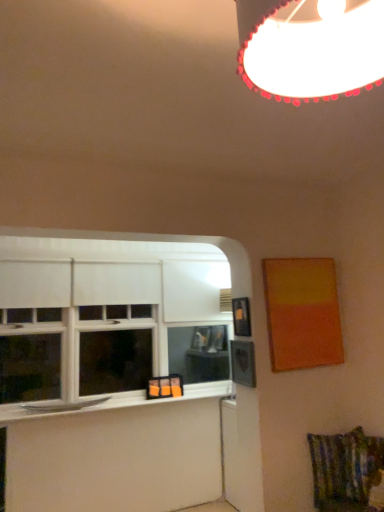
Question: Is white glossy window sill at lower left taller or shorter than white glossy lampshade at upper center?

Choices:
 (A) tall
 (B) short

Answer: (B)

Question: Considering the positions of point (117, 395) and point (312, 7), is point (117, 395) closer or farther from the camera than point (312, 7)?

Choices:
 (A) farther
 (B) closer

Answer: (A)

Question: Which is nearer to the matte orange painting at right, which is the 2th picture frame in left-to-right order?

Choices:
 (A) white matte window at lower left
 (B) white glossy window sill at lower left
 (C) textured multicolored fabric swivel chair at lower right
 (D) white glossy lampshade at upper center
 (E) black plastic picture frame at upper right, the second picture frame viewed from the right

Answer: (E)

Question: Which object is positioned closest to the black plastic picture frame at upper right, placed as the first picture frame when sorted from left to right?

Choices:
 (A) textured multicolored fabric swivel chair at lower right
 (B) matte orange painting at right, which is the 2th picture frame in left-to-right order
 (C) white glossy lampshade at upper center
 (D) white matte window at lower left
 (E) white glossy window sill at lower left

Answer: (B)